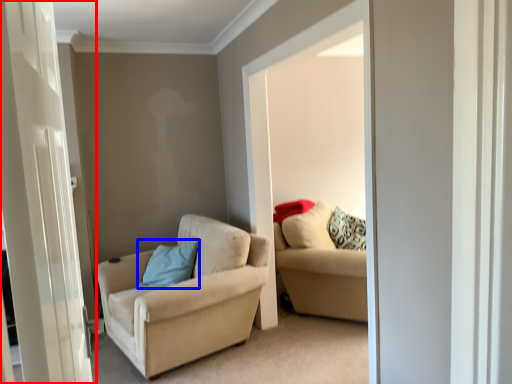
Question: Among these objects, which one is nearest to the camera, door (highlighted by a red box) or pillow (highlighted by a blue box)?

Choices:
 (A) door
 (B) pillow

Answer: (A)